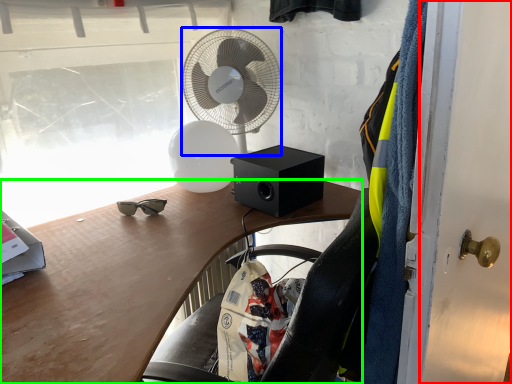
Question: Which object is positioned closest to door (highlighted by a red box)? Select from mechanical fan (highlighted by a blue box) and desk (highlighted by a green box).

Choices:
 (A) mechanical fan
 (B) desk

Answer: (B)